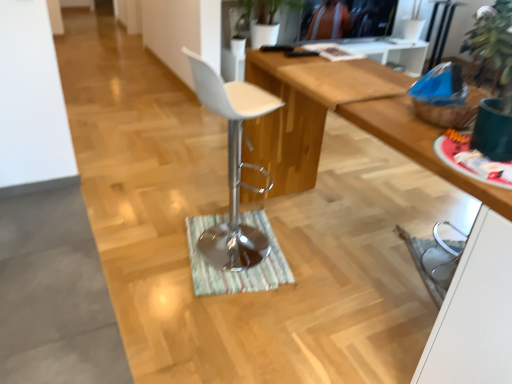
Question: Does point (452, 314) appear closer or farther from the camera than point (238, 167)?

Choices:
 (A) farther
 (B) closer

Answer: (B)

Question: Is white glossy cabinet at lower right inside or outside of white matte bar stool at center?

Choices:
 (A) outside
 (B) inside

Answer: (A)

Question: Estimate the real-world distances between objects in this image. Which object is closer to the wooden desk at center?

Choices:
 (A) green striped mat at center
 (B) matte black television at upper center
 (C) white glossy cabinet at lower right
 (D) white matte bar stool at center

Answer: (C)

Question: Estimate the real-world distances between objects in this image. Which object is farther from the wooden desk at center?

Choices:
 (A) matte black television at upper center
 (B) white glossy cabinet at lower right
 (C) white matte bar stool at center
 (D) green striped mat at center

Answer: (A)